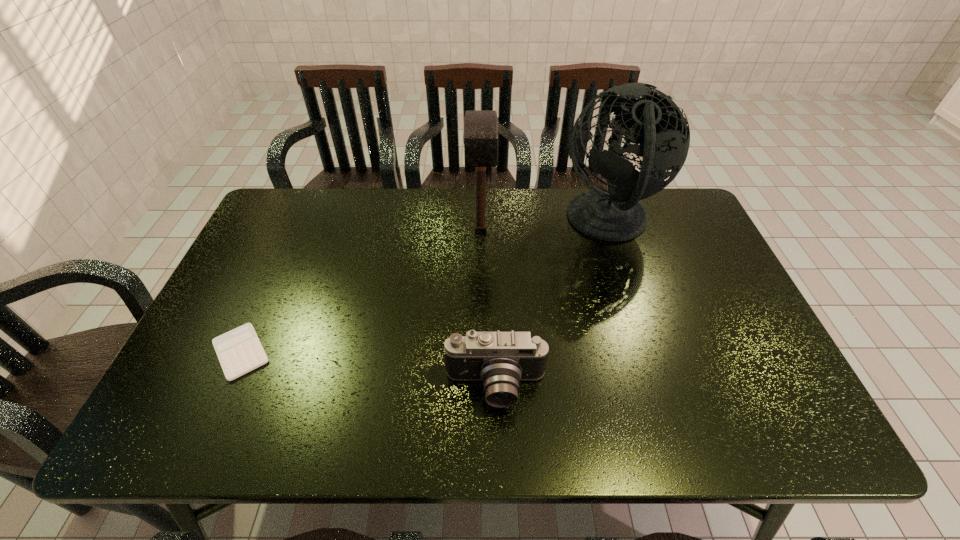
At what (x,y) coordinates should I click in order to perform the action: click on free space located 0.070m on the front-facing side of the third tallest object. Please return your answer as a coordinate pair (x, y). Image resolution: width=960 pixels, height=540 pixels. Looking at the image, I should click on (497, 445).

You are a GUI agent. You are given a task and a screenshot of the screen. Output one action in this format:
    pyautogui.click(x=<x>, y=<y>)
    Task: Click on the blank space located 0.150m on the right of the shortest object
    This screenshot has height=540, width=960.
    Given the screenshot: What is the action you would take?
    [335, 352]

Identify the location of globe located in the far edge section of the desktop. This screenshot has height=540, width=960. (658, 129).

This screenshot has width=960, height=540. Find the location of `mallet that is at the far edge`. mallet that is at the far edge is located at coordinates (480, 137).

Find the location of a particular element. The width and height of the screenshot is (960, 540). object that is at the near edge is located at coordinates pyautogui.click(x=500, y=360).

Where is `object that is at the left edge`? object that is at the left edge is located at coordinates (239, 351).

Find the location of a particular element. The image size is (960, 540). object that is at the right edge is located at coordinates (x=658, y=129).

Where is `object that is at the far right corner`? The image size is (960, 540). object that is at the far right corner is located at coordinates [x=658, y=129].

In the image, there is a desktop. Where is `vacant space at the far edge`? The height and width of the screenshot is (540, 960). vacant space at the far edge is located at coordinates (557, 231).

In the image, there is a desktop. Find the location of `free region at the near edge`. free region at the near edge is located at coordinates (563, 415).